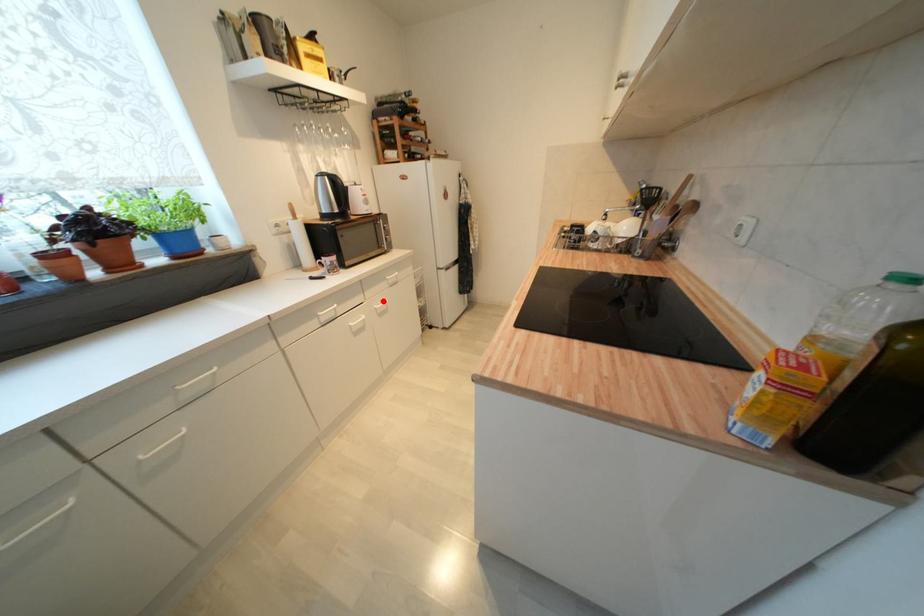
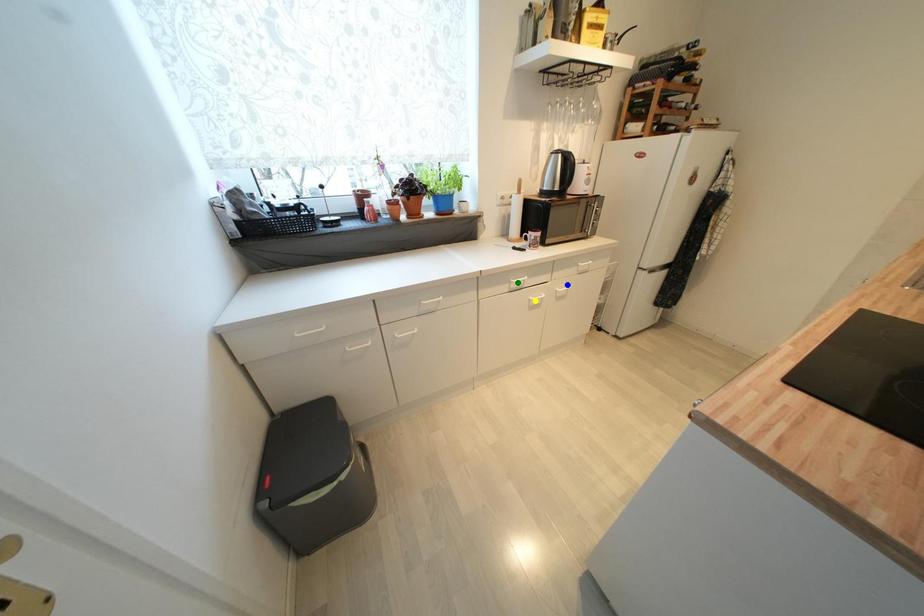
Question: I am providing you with two images of the same scene from different viewpoints. A red point is marked on the first image. You are given multiple points on the second image. Which spot in image 2 lines up with the point in image 1?

Choices:
 (A) blue point
 (B) yellow point
 (C) green point

Answer: (A)